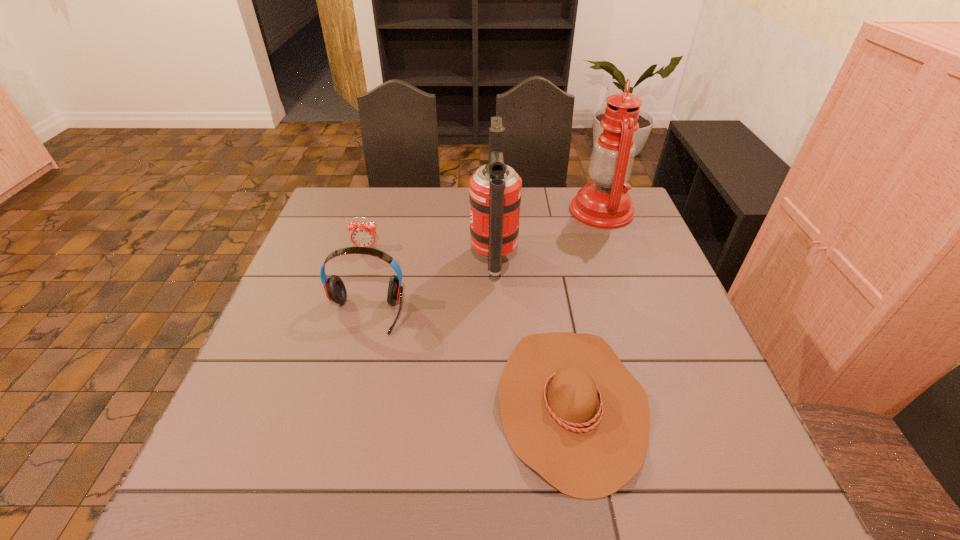
Identify the location of vacant area at the left edge of the desktop. (270, 374).

What are the coordinates of `vacant space at the right edge of the desktop` in the screenshot? It's located at (671, 345).

The width and height of the screenshot is (960, 540). In order to click on unoccupied area between the farthest object and the fire extinguisher in this screenshot , I will do pos(547,235).

At what (x,y) coordinates should I click in order to perform the action: click on unoccupied position between the oil lamp and the third tallest object. Please return your answer as a coordinate pair (x, y). The height and width of the screenshot is (540, 960). Looking at the image, I should click on (483, 262).

Image resolution: width=960 pixels, height=540 pixels. Find the location of `free space between the alarm clock and the shortest object`. free space between the alarm clock and the shortest object is located at coordinates (468, 326).

You are a GUI agent. You are given a task and a screenshot of the screen. Output one action in this format:
    pyautogui.click(x=<x>, y=<y>)
    Task: Click on the free space between the alarm clock and the shortest object
    This screenshot has width=960, height=540.
    Given the screenshot: What is the action you would take?
    pyautogui.click(x=468, y=326)

Locate an element on the screen. This screenshot has width=960, height=540. blank region between the alarm clock and the third shortest object is located at coordinates (366, 281).

At what (x,y) coordinates should I click in order to perform the action: click on vacant point located between the fire extinguisher and the headset. Please return your answer as a coordinate pair (x, y). Image resolution: width=960 pixels, height=540 pixels. Looking at the image, I should click on (429, 287).

What are the coordinates of `vacant area between the farthest object and the cowboy hat` in the screenshot? It's located at (587, 307).

At what (x,y) coordinates should I click in order to perform the action: click on free space that is in between the cowboy hat and the oil lamp. Please return your answer as a coordinate pair (x, y). The image size is (960, 540). Looking at the image, I should click on (587, 307).